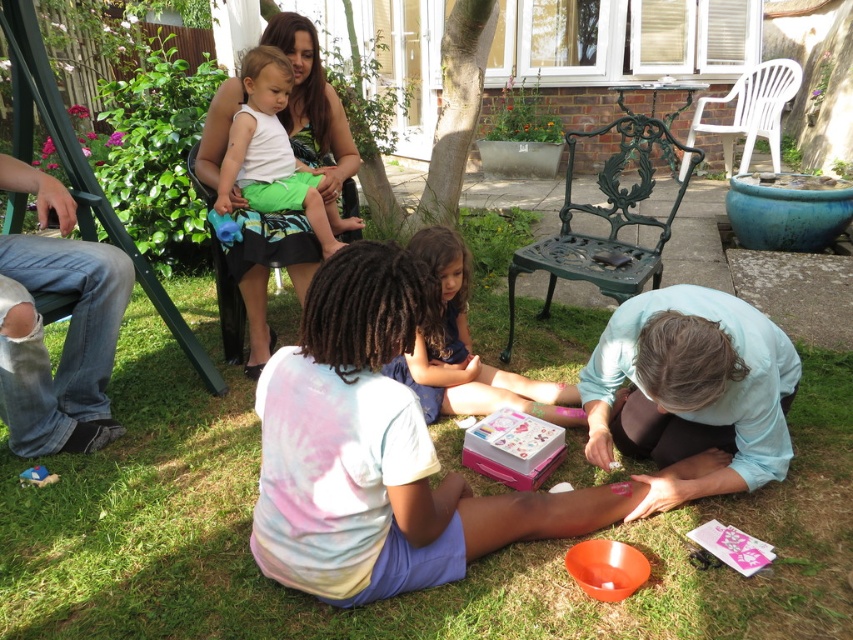
Question: Estimate the real-world distances between objects in this image. Which object is farther from the light blue fabric at lower right?

Choices:
 (A) smooth blue dress at center
 (B) white matte shirt at upper center
 (C) ripped denim jeans at lower left
 (D) green grass at lower center

Answer: (C)

Question: Is ripped denim jeans at lower left closer to camera compared to white matte shirt at upper center?

Choices:
 (A) yes
 (B) no

Answer: (A)

Question: Is green grass at lower center above white matte shirt at upper center?

Choices:
 (A) no
 (B) yes

Answer: (A)

Question: Based on their relative distances, which object is nearer to the smooth blue dress at center?

Choices:
 (A) ripped denim jeans at lower left
 (B) green grass at lower center
 (C) light blue fabric at lower right

Answer: (C)

Question: Which point is closer to the camera taking this photo?

Choices:
 (A) (33, 371)
 (B) (500, 387)

Answer: (A)

Question: Can you confirm if light blue fabric at lower right is smaller than smooth blue dress at center?

Choices:
 (A) yes
 (B) no

Answer: (A)